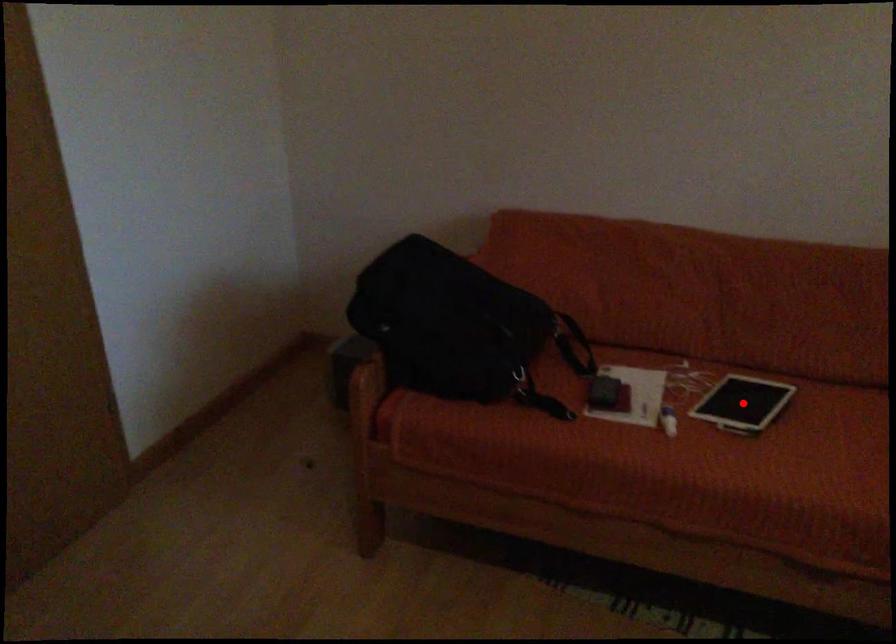
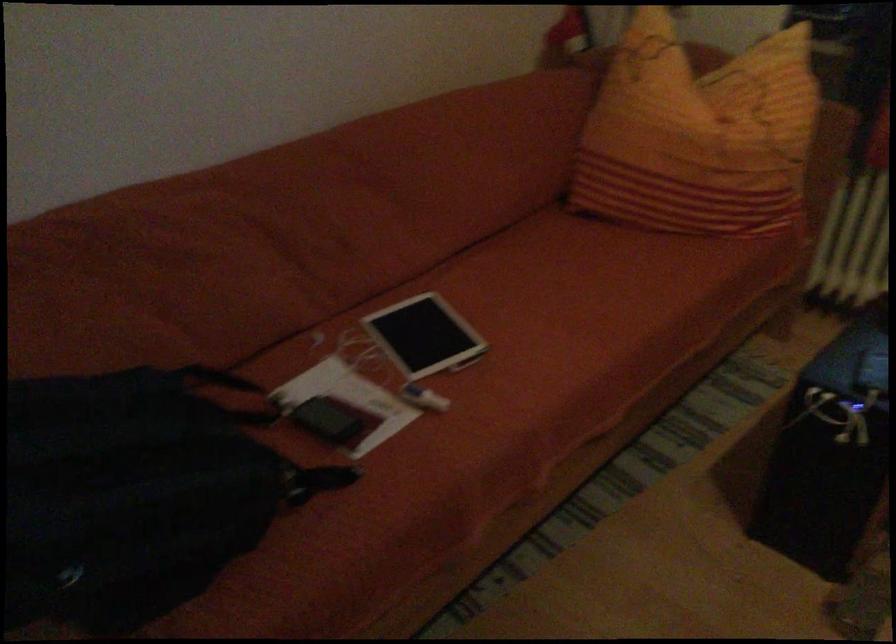
Question: I am providing you with two images of the same scene from different viewpoints. A red point is marked on the first image. Is the red point's position out of view in image 2?

Choices:
 (A) Yes
 (B) No

Answer: (A)